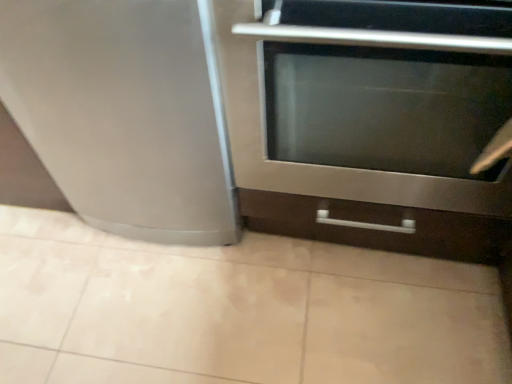
Question: Can you confirm if stainless steel oven at center is smaller than satin silver refrigerator at left?

Choices:
 (A) no
 (B) yes

Answer: (A)

Question: From the image's perspective, is stainless steel oven at center located beneath satin silver refrigerator at left?

Choices:
 (A) yes
 (B) no

Answer: (A)

Question: Does stainless steel oven at center lie in front of satin silver refrigerator at left?

Choices:
 (A) no
 (B) yes

Answer: (B)

Question: Would you say stainless steel oven at center is outside satin silver refrigerator at left?

Choices:
 (A) no
 (B) yes

Answer: (B)

Question: From the image's perspective, is stainless steel oven at center on satin silver refrigerator at left?

Choices:
 (A) yes
 (B) no

Answer: (B)

Question: Are stainless steel oven at center and satin silver refrigerator at left located far from each other?

Choices:
 (A) no
 (B) yes

Answer: (A)

Question: From the image's perspective, is stainless steel oven at center below beige ceramic tile at lower center?

Choices:
 (A) no
 (B) yes

Answer: (A)

Question: Does stainless steel oven at center have a greater height compared to beige ceramic tile at lower center?

Choices:
 (A) no
 (B) yes

Answer: (B)

Question: Is stainless steel oven at center oriented towards beige ceramic tile at lower center?

Choices:
 (A) yes
 (B) no

Answer: (B)

Question: Considering the relative sizes of stainless steel oven at center and beige ceramic tile at lower center in the image provided, is stainless steel oven at center bigger than beige ceramic tile at lower center?

Choices:
 (A) yes
 (B) no

Answer: (A)

Question: Considering the relative positions of stainless steel oven at center and beige ceramic tile at lower center in the image provided, is stainless steel oven at center in front of beige ceramic tile at lower center?

Choices:
 (A) no
 (B) yes

Answer: (B)

Question: From a real-world perspective, is stainless steel oven at center positioned under beige ceramic tile at lower center based on gravity?

Choices:
 (A) no
 (B) yes

Answer: (A)

Question: From a real-world perspective, does satin silver refrigerator at left stand above stainless steel oven at center?

Choices:
 (A) yes
 (B) no

Answer: (B)